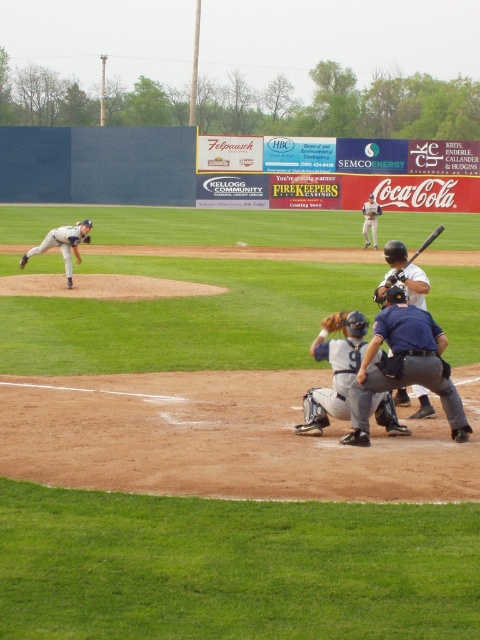
You are a coach observing the baseball game. You notice the white matte bat at center and the white matte baseball at center. How far apart are these two items from each other?

The white matte bat at center is 19.94 meters away from the white matte baseball at center.

You are a drone operator trying to capture the best angle of the baseball game. You need to fly your drone to two specific points on the field marked as point [409,259] and point [238,244]. Which point should you fly to first if you want to get closer to the action near the batter and catcher?

Point [409,259] is closer to the viewer than point [238,244], so you should fly to point [409,259] first to be closer to the action near the batter and catcher.

You are a player in the baseball game and you want to retrieve your black matte bat at center. Where exactly is it located on the field?

The black matte bat at center is located at point coordinates of (x=425, y=243).